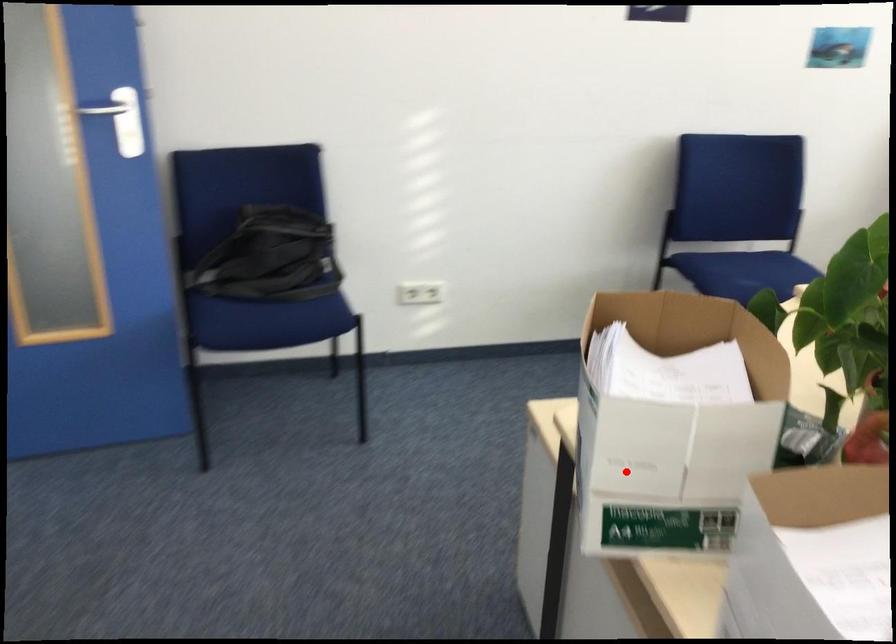
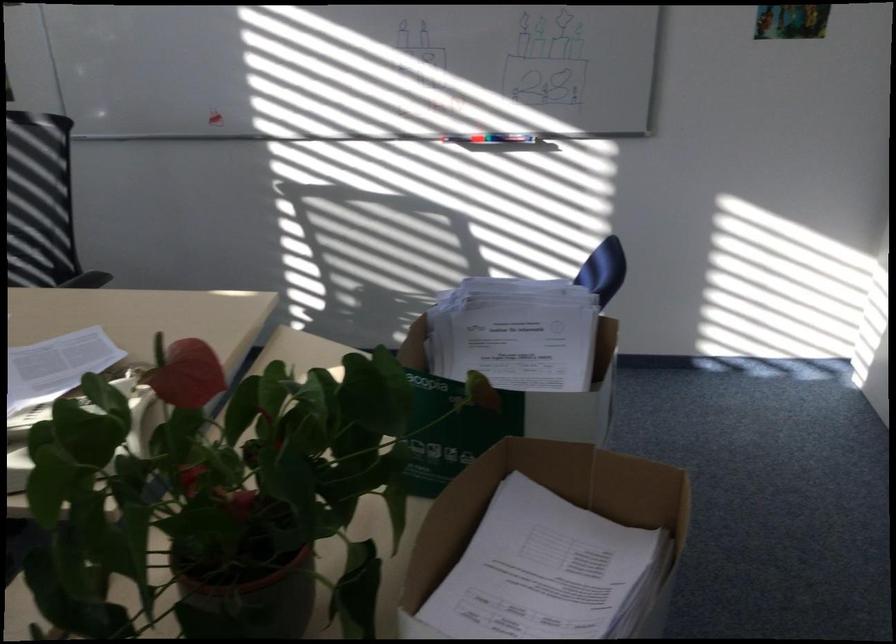
In the second image, find the point that corresponds to the highlighted location in the first image.

(550, 515)